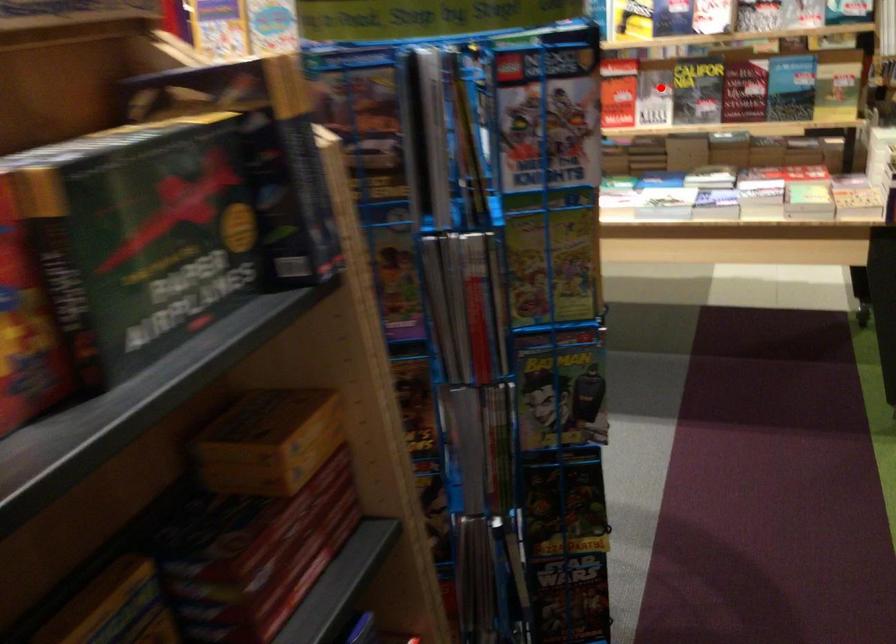
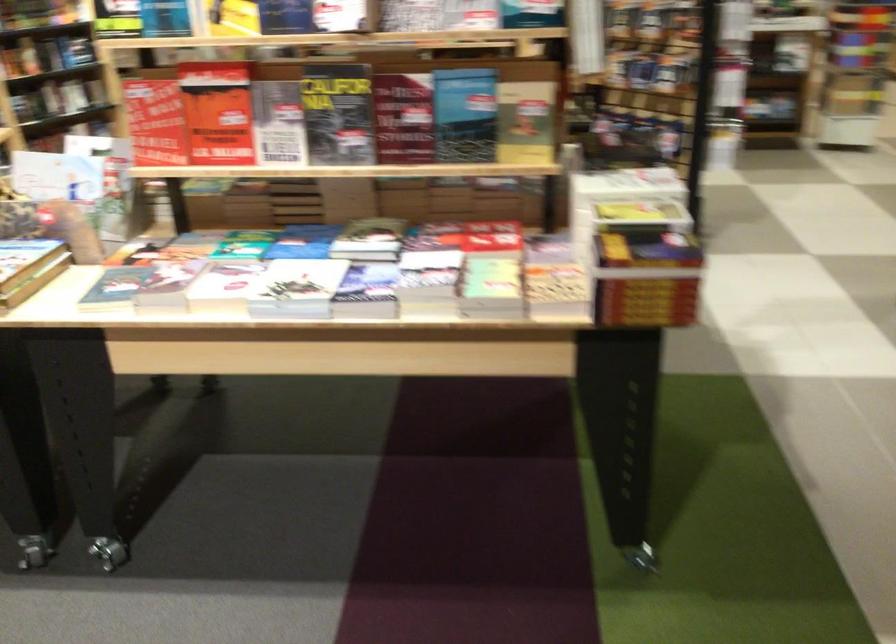
The point at the highlighted location is marked in the first image. Where is the corresponding point in the second image?

(279, 122)